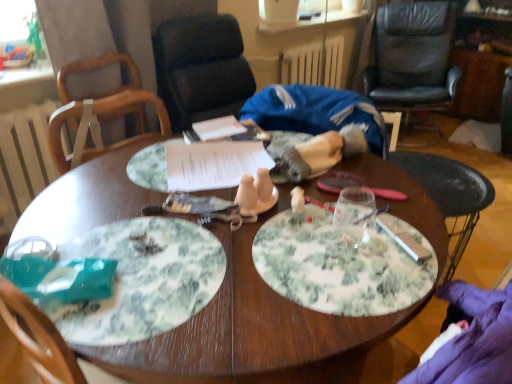
Describe the element at coordinates (144, 242) in the screenshot. The image size is (512, 384). I see `white crumbly food at center` at that location.

Looking at this image, how much space does black leather chair at upper right, placed as the 1th chair when sorted from right to left, occupy vertically?

It is 96.01 centimeters.

The height and width of the screenshot is (384, 512). What do you see at coordinates (413, 57) in the screenshot?
I see `black leather chair at upper right, acting as the second chair starting from the left` at bounding box center [413, 57].

The width and height of the screenshot is (512, 384). I want to click on green floral plate at center, which is the first plate in bottom-to-top order, so click(142, 281).

Image resolution: width=512 pixels, height=384 pixels. What do you see at coordinates (142, 281) in the screenshot? I see `green floral plate at center, which appears as the second plate when viewed from the back` at bounding box center [142, 281].

In order to face white painted wood radiator at left, the 2th radiator from the right, should I rotate leftwards or rightwards?

Rotate left and turn 27.517 degrees.

The height and width of the screenshot is (384, 512). Identify the location of floral paper plate at center, the second plate in the front-to-back sequence. (149, 168).

What do you see at coordinates (149, 168) in the screenshot?
I see `floral paper plate at center, positioned as the second plate in bottom-to-top order` at bounding box center [149, 168].

This screenshot has width=512, height=384. Describe the element at coordinates (112, 102) in the screenshot. I see `wooden chair at upper left, which is the 1th chair in left-to-right order` at that location.

Where is `white crumbly food at center`? white crumbly food at center is located at coordinates coord(144,242).

Which is correct: black leather chair at upper right, acting as the second chair starting from the left, is inside wooden chair at upper left, arranged as the 2th chair when viewed from the right, or outside of it?

The correct answer is: outside.

Is black leather chair at upper right, which is the 2th chair from front to back, bigger or smaller than wooden chair at upper left, acting as the 1th chair starting from the front?

Considering their sizes, black leather chair at upper right, which is the 2th chair from front to back, takes up more space than wooden chair at upper left, acting as the 1th chair starting from the front.

Looking at this image, can you tell me how much black leather chair at upper right, acting as the second chair starting from the left, and wooden chair at upper left, acting as the 1th chair starting from the front, differ in facing direction?

They differ by 71.6 degrees in their facing directions.

From the image's perspective, is floral paper plate at center, arranged as the first plate when viewed from the back, over white crumbly food at center?

Yes, from the image's perspective, floral paper plate at center, arranged as the first plate when viewed from the back, is over white crumbly food at center.

Consider the image. From a real-world perspective, is floral paper plate at center, the second plate in the front-to-back sequence, physically located above or below white crumbly food at center?

floral paper plate at center, the second plate in the front-to-back sequence, is situated higher than white crumbly food at center in the real world.

Is floral paper plate at center, positioned as the second plate in bottom-to-top order, positioned beyond the bounds of white crumbly food at center?

floral paper plate at center, positioned as the second plate in bottom-to-top order, lies outside white crumbly food at center's area.

What's the angular difference between green floral plate at center, which ranks as the 2th plate in top-to-bottom order, and black leather chair at upper right, acting as the second chair starting from the left,'s facing directions?

156 degrees.

Are green floral plate at center, which is the first plate in bottom-to-top order, and black leather chair at upper right, which is the 2th chair from front to back, beside each other?

No, green floral plate at center, which is the first plate in bottom-to-top order, is not in contact with black leather chair at upper right, which is the 2th chair from front to back.

Is black leather chair at upper right, acting as the second chair starting from the left, inside green floral plate at center, which is the first plate in bottom-to-top order?

That's incorrect, black leather chair at upper right, acting as the second chair starting from the left, is not inside green floral plate at center, which is the first plate in bottom-to-top order.

Is green floral plate at center, which is the first plate in bottom-to-top order, wider or thinner than black leather chair at upper right, placed as the 1th chair when sorted from right to left?

Clearly, green floral plate at center, which is the first plate in bottom-to-top order, has less width compared to black leather chair at upper right, placed as the 1th chair when sorted from right to left.

Considering the points (2, 186) and (146, 241), which point is behind, point (2, 186) or point (146, 241)?

The point (2, 186) is more distant.

Is white painted wood radiator at left, arranged as the 1th radiator when viewed from the left, bigger than white crumbly food at center?

Yes, white painted wood radiator at left, arranged as the 1th radiator when viewed from the left, is bigger than white crumbly food at center.

Is white painted wood radiator at left, the 2th radiator from the right, touching white crumbly food at center?

No, white painted wood radiator at left, the 2th radiator from the right, is not making contact with white crumbly food at center.

Visually, is white painted wood radiator at left, the first radiator from the bottom, positioned to the left or to the right of white crumbly food at center?

Based on their positions, white painted wood radiator at left, the first radiator from the bottom, is located to the left of white crumbly food at center.

Image resolution: width=512 pixels, height=384 pixels. Find the location of `food positioned vertically above the white painted wood radiator at left, the 2th radiator from the right (from a real-world perspective)`. food positioned vertically above the white painted wood radiator at left, the 2th radiator from the right (from a real-world perspective) is located at coordinates (144, 242).

Can you tell me how much white crumbly food at center and white painted wood radiator at left, arranged as the 1th radiator when viewed from the left, differ in facing direction?

They differ by 69 degrees in their facing directions.

Based on the photo, would you say white crumbly food at center is outside white painted wood radiator at left, the first radiator when ordered from front to back?

Indeed, white crumbly food at center is completely outside white painted wood radiator at left, the first radiator when ordered from front to back.

Between white crumbly food at center and white painted wood radiator at left, acting as the second radiator starting from the back, which one has smaller size?

white crumbly food at center.

Which point is more forward, [40,179] or [145,171]?

The point [145,171] is closer.

In terms of width, does white painted wood radiator at left, the first radiator when ordered from front to back, look wider or thinner when compared to floral paper plate at center, which is counted as the 1th plate, starting from the top?

Clearly, white painted wood radiator at left, the first radiator when ordered from front to back, has less width compared to floral paper plate at center, which is counted as the 1th plate, starting from the top.

From a real-world perspective, between white painted wood radiator at left, the first radiator when ordered from front to back, and floral paper plate at center, which is counted as the 1th plate, starting from the top, who is vertically lower?

white painted wood radiator at left, the first radiator when ordered from front to back.

Consider the image. From the image's perspective, is black leather chair at upper right, marked as the 1th chair in a back-to-front arrangement, located above or below floral paper plate at center, positioned as the second plate in bottom-to-top order?

Based on their image positions, black leather chair at upper right, marked as the 1th chair in a back-to-front arrangement, is located above floral paper plate at center, positioned as the second plate in bottom-to-top order.

Is floral paper plate at center, positioned as the second plate in bottom-to-top order, a part of black leather chair at upper right, which is the 2th chair from front to back?

No, black leather chair at upper right, which is the 2th chair from front to back, does not contain floral paper plate at center, positioned as the second plate in bottom-to-top order.

Is floral paper plate at center, positioned as the second plate in bottom-to-top order, at the back of black leather chair at upper right, placed as the 1th chair when sorted from right to left?

No, black leather chair at upper right, placed as the 1th chair when sorted from right to left, is not facing the opposite direction of floral paper plate at center, positioned as the second plate in bottom-to-top order.

You are a GUI agent. You are given a task and a screenshot of the screen. Output one action in this format:
    pyautogui.click(x=<x>, y=<y>)
    Task: Click on the 2nd chair behind the floral paper plate at center, which is counted as the 1th plate, starting from the top, starting your count from the anchor
    
    Given the screenshot: What is the action you would take?
    pos(413,57)

Where is `chair that appears behind the wooden chair at upper left, acting as the 1th chair starting from the front`? This screenshot has height=384, width=512. chair that appears behind the wooden chair at upper left, acting as the 1th chair starting from the front is located at coordinates [413, 57].

Locate an element on the screen. plate on the right of the white crumbly food at center is located at coordinates (149, 168).

When comparing their distances from green floral plate at center, which ranks as the 2th plate in top-to-bottom order, does floral paper plate at center, positioned as the second plate in bottom-to-top order, or wooden chair at upper left, which is the 1th chair in left-to-right order, seem further?

Among the two, wooden chair at upper left, which is the 1th chair in left-to-right order, is located further to green floral plate at center, which ranks as the 2th plate in top-to-bottom order.

Estimate the real-world distances between objects in this image. Which object is closer to wooden chair at upper left, arranged as the second chair when viewed from the back, floral paper plate at center, the second plate in the front-to-back sequence, or white painted wood radiator at left, the 2th radiator from the right?

white painted wood radiator at left, the 2th radiator from the right, lies closer to wooden chair at upper left, arranged as the second chair when viewed from the back, than the other object.

Estimate the real-world distances between objects in this image. Which object is further from black leather chair at upper right, which is the 2th chair from front to back, floral paper plate at center, the second plate in the front-to-back sequence, or white crumbly food at center?

Based on the image, white crumbly food at center appears to be further to black leather chair at upper right, which is the 2th chair from front to back.

When comparing their distances from green floral plate at center, which ranks as the 2th plate in top-to-bottom order, does black leather chair at upper right, placed as the 1th chair when sorted from right to left, or white painted wood radiator at left, the 2th radiator viewed from the top, seem further?

black leather chair at upper right, placed as the 1th chair when sorted from right to left.

Looking at this image, considering their positions, is white painted metal radiator at upper center, placed as the second radiator when sorted from left to right, positioned further to wooden chair at upper left, acting as the 1th chair starting from the front, than green floral plate at center, which is the first plate in bottom-to-top order?

white painted metal radiator at upper center, placed as the second radiator when sorted from left to right, lies further to wooden chair at upper left, acting as the 1th chair starting from the front, than the other object.

From the image, which object appears to be farther from white painted wood radiator at left, the first radiator from the bottom, floral paper plate at center, the second plate in the front-to-back sequence, or white painted metal radiator at upper center, which appears as the 2th radiator when viewed from the front?

Among the two, white painted metal radiator at upper center, which appears as the 2th radiator when viewed from the front, is located further to white painted wood radiator at left, the first radiator from the bottom.

From the image, which object appears to be farther from floral paper plate at center, the second plate in the front-to-back sequence, green floral plate at center, the first plate positioned from the front, or black leather chair at upper right, acting as the second chair starting from the left?

black leather chair at upper right, acting as the second chair starting from the left, lies further to floral paper plate at center, the second plate in the front-to-back sequence, than the other object.

Looking at the image, which one is located closer to white painted metal radiator at upper center, arranged as the 1th radiator when viewed from the back, black leather chair at upper right, which is the 2th chair from front to back, or wooden chair at upper left, arranged as the 2th chair when viewed from the right?

Among the two, black leather chair at upper right, which is the 2th chair from front to back, is located nearer to white painted metal radiator at upper center, arranged as the 1th radiator when viewed from the back.

Find the location of `radiator situated between white painted wood radiator at left, the 2th radiator from the right, and black leather chair at upper right, acting as the second chair starting from the left, from left to right`. radiator situated between white painted wood radiator at left, the 2th radiator from the right, and black leather chair at upper right, acting as the second chair starting from the left, from left to right is located at coordinates (313, 63).

Identify the location of radiator located between white crumbly food at center and white painted metal radiator at upper center, the second radiator positioned from the bottom, in the depth direction. (23, 160).

Locate an element on the screen. This screenshot has width=512, height=384. plate between green floral plate at center, which is the first plate in bottom-to-top order, and white painted metal radiator at upper center, placed as the second radiator when sorted from left to right, from front to back is located at coordinates (149, 168).

Locate an element on the screen. Image resolution: width=512 pixels, height=384 pixels. chair between green floral plate at center, which appears as the second plate when viewed from the back, and white painted wood radiator at left, arranged as the 1th radiator when viewed from the left, along the z-axis is located at coordinates (112, 102).